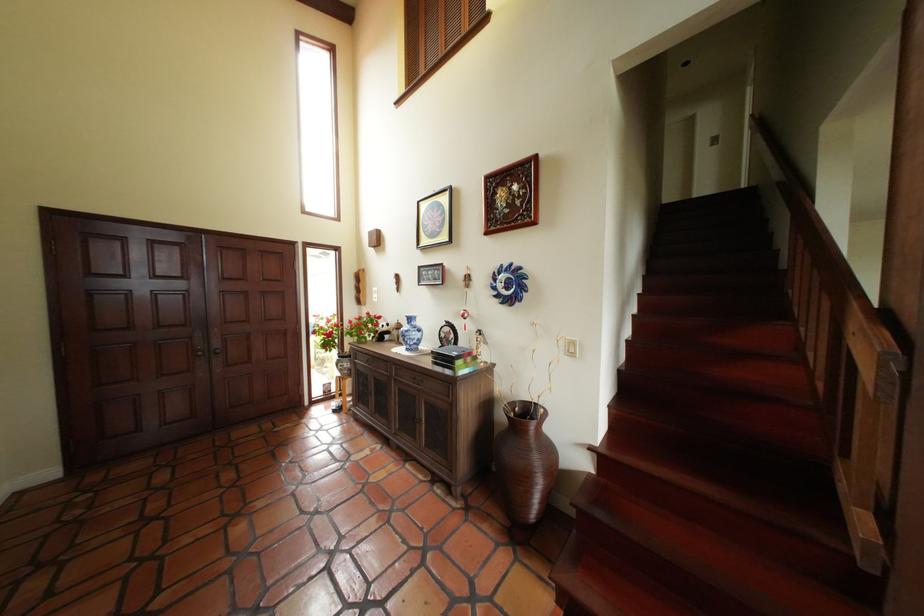
Where would you lift the small black box? Please return your answer as a coordinate pair (x, y).

(454, 357)